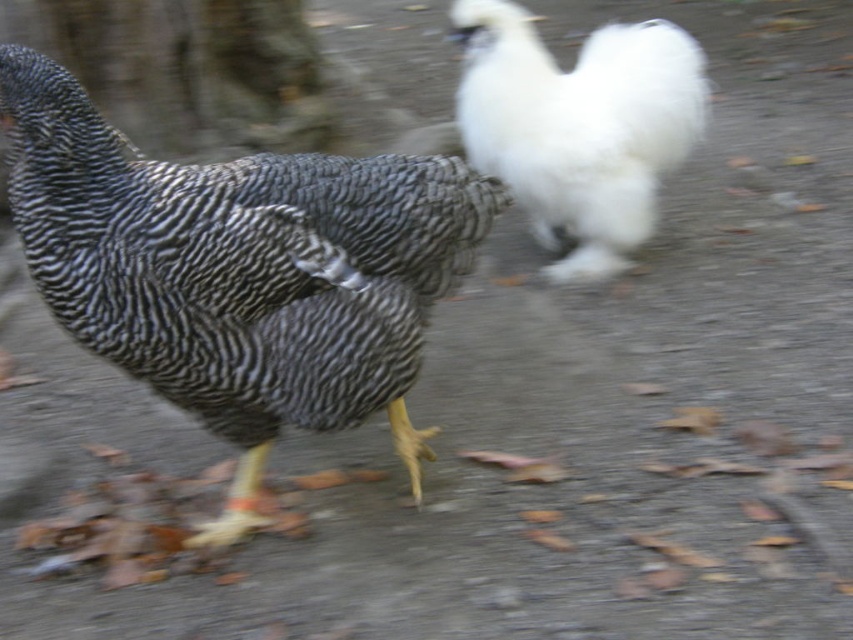
You are a farmer checking on your chickens. You notice the speckled feathered chicken at left and the white fluffy chicken at upper right. Which chicken would cast a longer shadow given the daylight mentioned in the scene?

The speckled feathered chicken at left is larger in size than the white fluffy chicken at upper right, so it would cast a longer shadow.